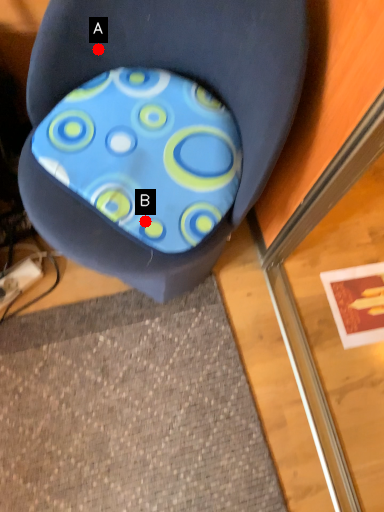
Question: Two points are circled on the image, labeled by A and B beside each circle. Which point is closer to the camera taking this photo?

Choices:
 (A) A is closer
 (B) B is closer

Answer: (B)